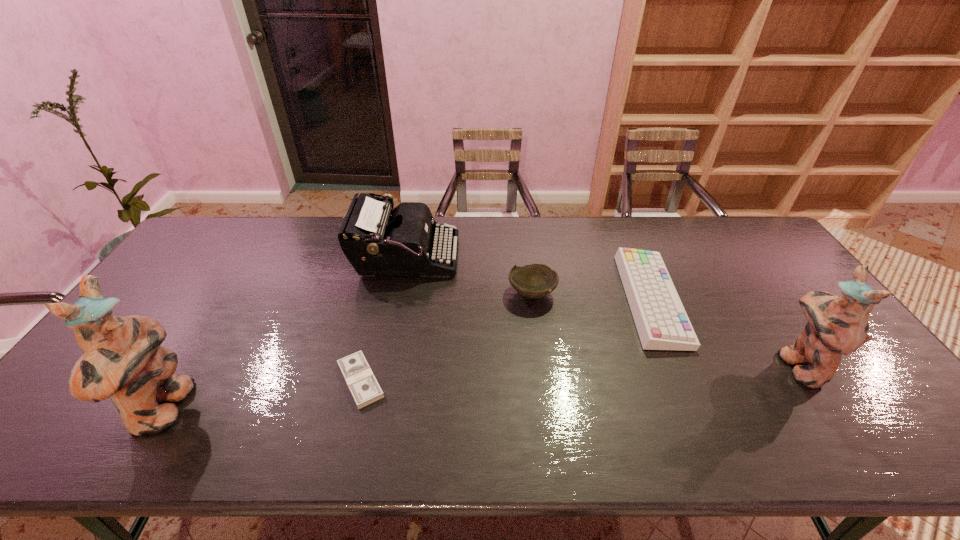
The height and width of the screenshot is (540, 960). I want to click on the left figurine, so click(122, 359).

The height and width of the screenshot is (540, 960). I want to click on the taller figurine, so click(x=122, y=359).

This screenshot has width=960, height=540. I want to click on the fifth shortest object, so click(x=836, y=325).

Find the location of `the rightmost object`. the rightmost object is located at coordinates (836, 325).

Find the location of a particular element. The height and width of the screenshot is (540, 960). the fourth shortest object is located at coordinates (378, 241).

At what (x,y) coordinates should I click in order to perform the action: click on the fourth object from left to right. Please return your answer as a coordinate pair (x, y). Looking at the image, I should click on (536, 280).

Image resolution: width=960 pixels, height=540 pixels. Identify the location of the fourth tallest object. (536, 280).

Where is `computer keyboard`? computer keyboard is located at coordinates (662, 323).

The height and width of the screenshot is (540, 960). I want to click on the second shortest object, so click(x=662, y=323).

Find the location of a particular element. The image size is (960, 540). dollar is located at coordinates (356, 371).